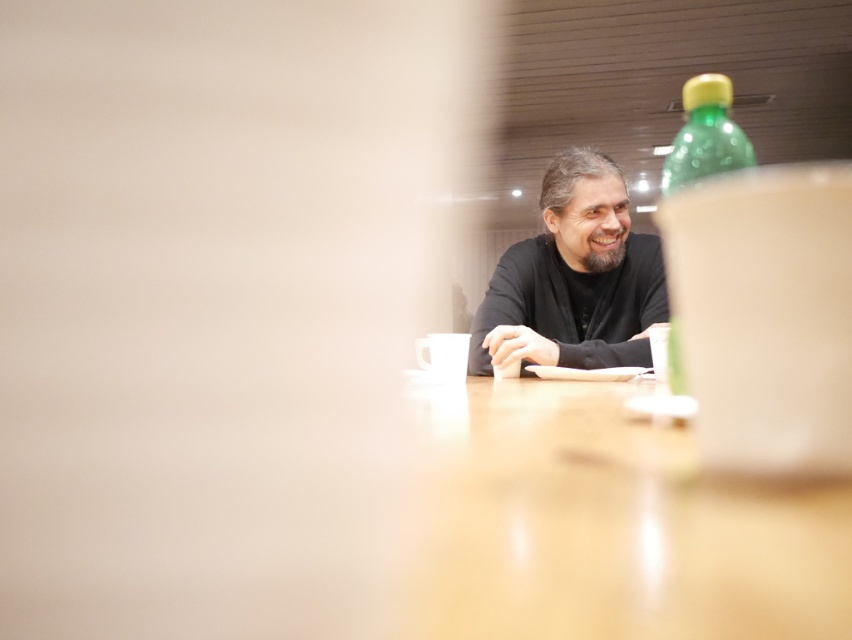
You are standing in the meeting room and want to place a document on the light brown polished wood table at center. Based on its position, where would you look to find it?

The light brown polished wood table at center is located at point 0.823 on the x axis and 0.715 on the y axis.

You are sitting in a chair in the meeting room and want to reach for the green plastic bottle at upper right. Is the light brown polished wood table at center blocking your direct path to the bottle?

The light brown polished wood table at center is in front of the green plastic bottle at upper right, so it is blocking your direct path to the bottle.

You are a guest entering the room and want to place a small notebook on the table. Where should you place it to ensure it is between the light brown polished wood table at center and the green translucent bottle at upper right?

The light brown polished wood table at center is below the green translucent bottle at upper right, so you should place the notebook on the table between them, ensuring it is closer to the table since it is positioned below the bottle.